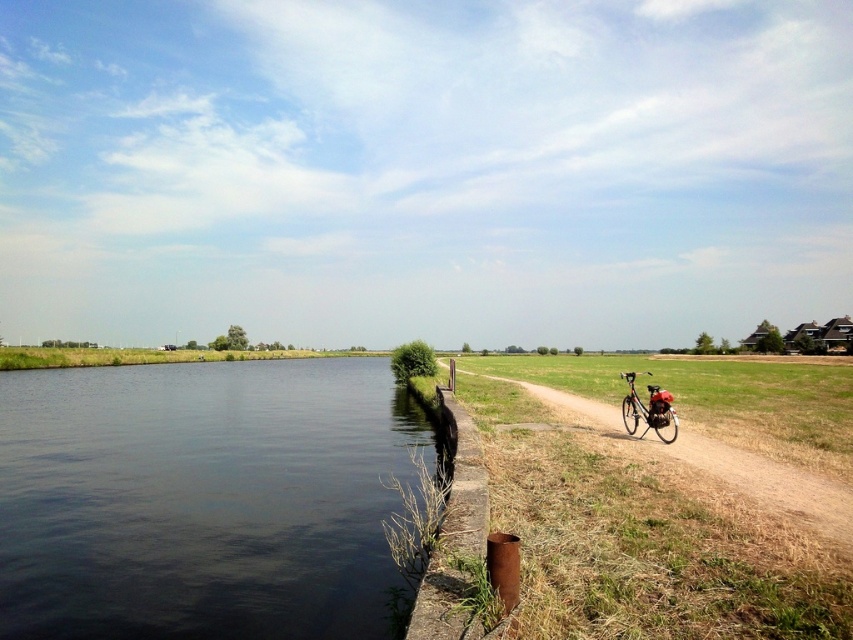
You are standing at the edge of the dark water at center and want to reach the shiny metallic bicycle at right. Which direction should you walk to get there?

Since the dark water at center is closer to the viewer than the shiny metallic bicycle at right, you should walk away from the water towards the right to reach the bicycle.

You are standing at the point labeled as point (769, 483) in the image. What is the surface you are standing on?

The point (769, 483) corresponds to the brown dirt path at right, so you are standing on the brown dirt path at right.